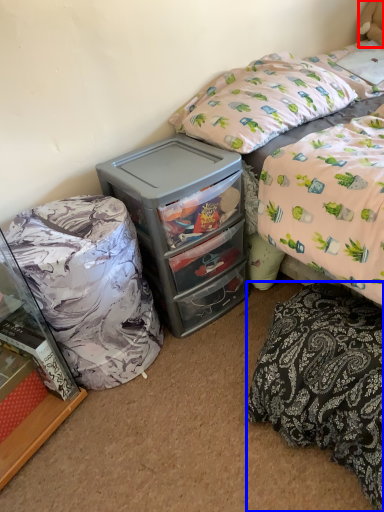
Question: Which point is closer to the camera, teddy bear (highlighted by a red box) or mattress (highlighted by a blue box)?

Choices:
 (A) teddy bear
 (B) mattress

Answer: (B)